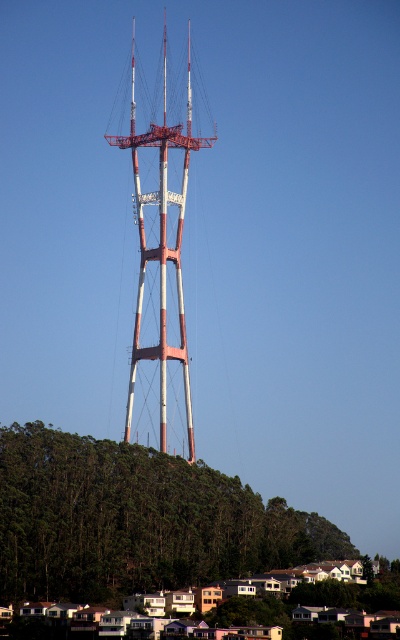
From the picture: You are planning to install a new communication antenna on the metallic red and white tower at center. The antenna requires a clear line of sight and must be at least 150 feet away from any obstructions like hills. Based on the image, will the green leafy hillside at lower left interfere with the antenna installation?

The distance between the metallic red and white tower at center and the green leafy hillside at lower left is 132.55 feet, which is less than the required 150 feet. Therefore, the hillside may interfere with the antenna installation as it is closer than the minimum distance required.

Consider the image. What is the spatial relationship between the green leafy hillside at lower left and the red and white tower in the image?

The green leafy hillside at lower left is positioned at coordinates point [136,520], which places it near the lower left area of the image, while the red and white tower stands prominently in the center against the clear blue sky.